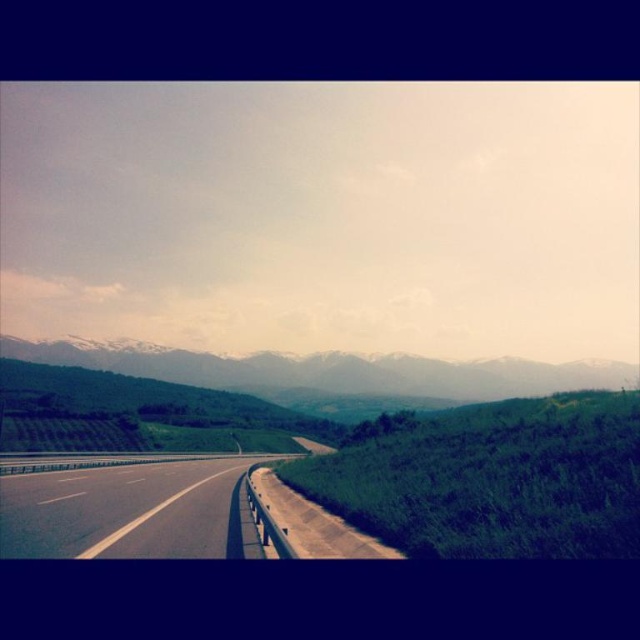
Question: Which of these objects is positioned closest to the black asphalt highway at center?

Choices:
 (A) snowy rock mountain at upper center
 (B) green grassy hill at right

Answer: (B)

Question: Which point is farther from the camera taking this photo?

Choices:
 (A) (440, 372)
 (B) (593, 497)

Answer: (A)

Question: Can you confirm if green grassy hill at right is positioned above black asphalt highway at center?

Choices:
 (A) yes
 (B) no

Answer: (A)

Question: Is snowy rock mountain at upper center positioned behind black asphalt highway at center?

Choices:
 (A) no
 (B) yes

Answer: (B)

Question: Can you confirm if snowy rock mountain at upper center is smaller than black asphalt highway at center?

Choices:
 (A) no
 (B) yes

Answer: (A)

Question: Which object is the closest to the black asphalt highway at center?

Choices:
 (A) green grassy hill at right
 (B) snowy rock mountain at upper center

Answer: (A)